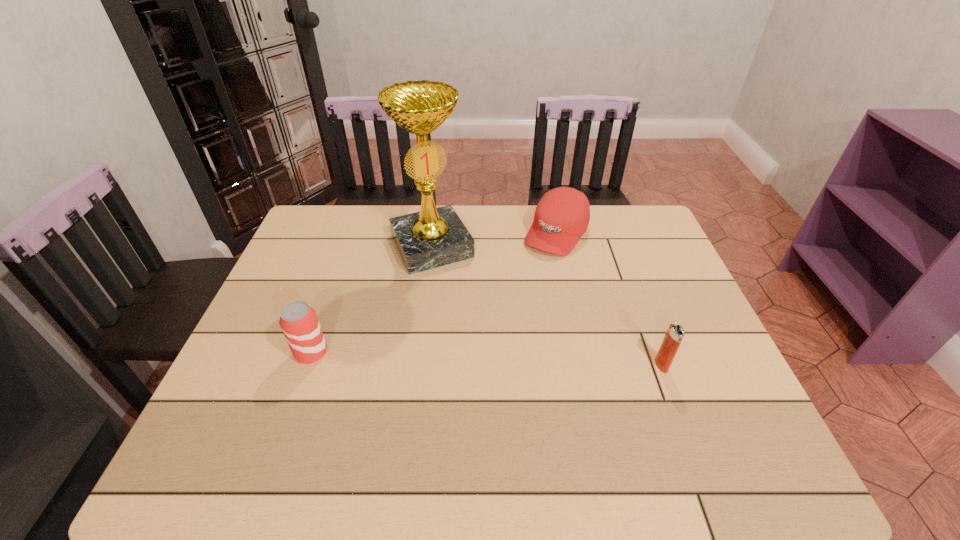
Find the location of `free space on the desktop that is between the leftmost object and the rightmost object and is positioned on the front-facing side of the award`. free space on the desktop that is between the leftmost object and the rightmost object and is positioned on the front-facing side of the award is located at coordinates (493, 359).

Identify the location of free space on the desktop that is between the leftmost object and the igniter and is positioned on the front-facing side of the cap. (467, 358).